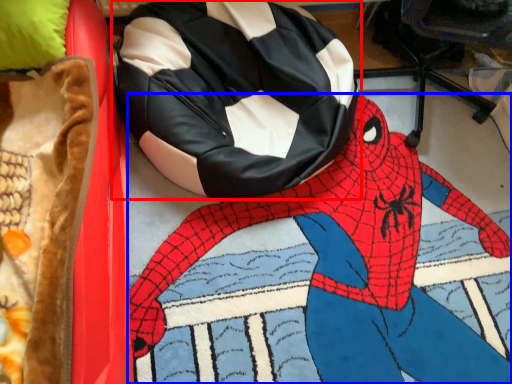
Question: Among these objects, which one is nearest to the camera, bean bag chair (highlighted by a red box) or person (highlighted by a blue box)?

Choices:
 (A) bean bag chair
 (B) person

Answer: (B)